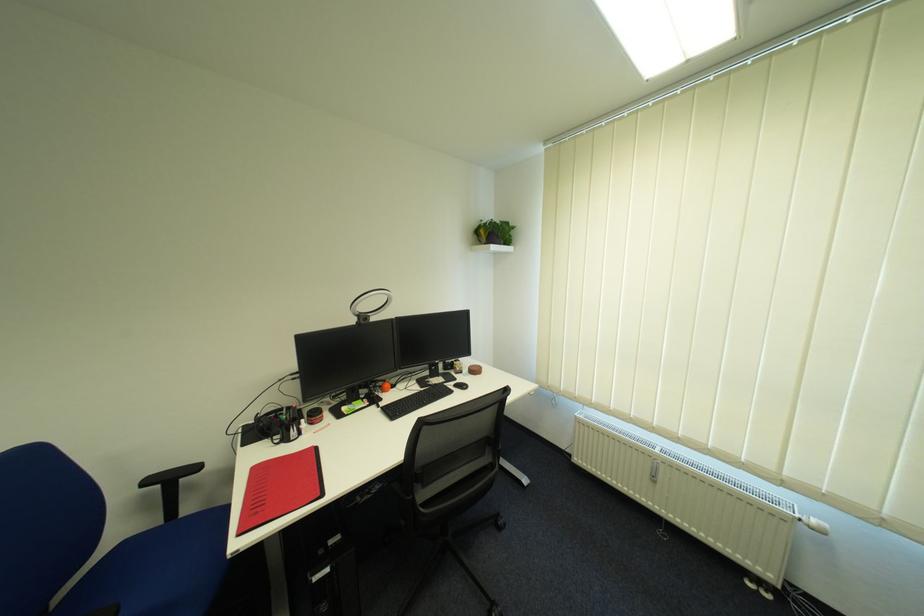
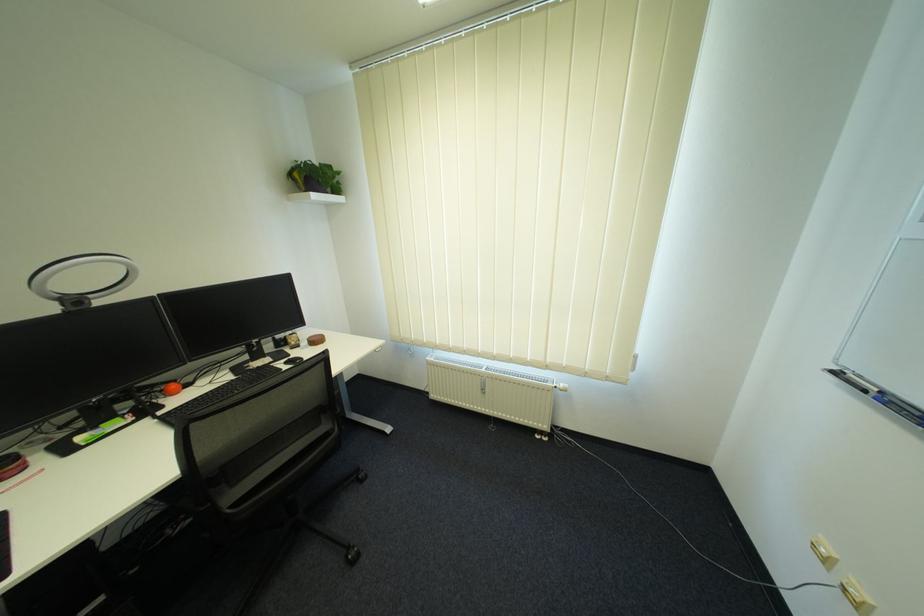
Question: In a continuous first-person perspective shot, in which direction is the camera moving?

Choices:
 (A) Left
 (B) Right
 (C) Forward
 (D) Backward

Answer: (B)